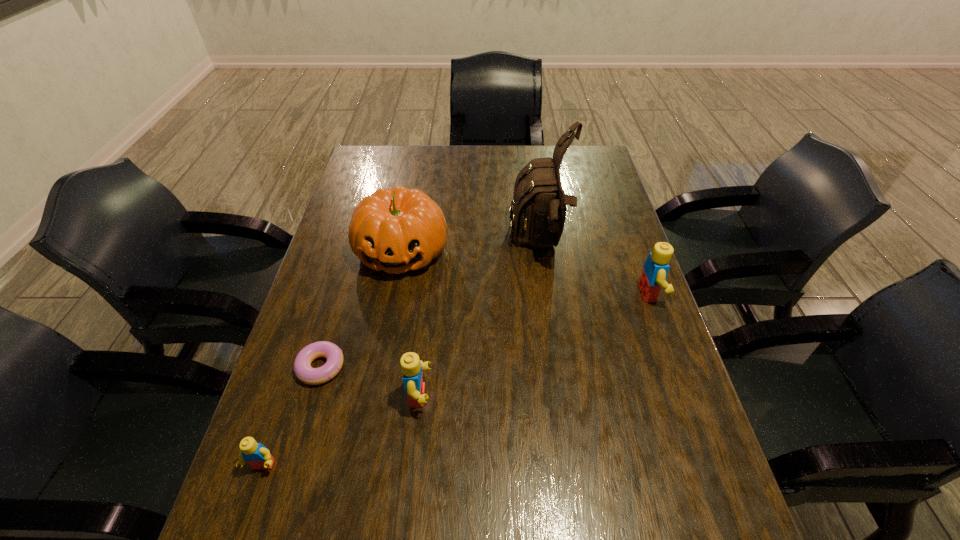
I want to click on object that is at the right edge, so click(655, 269).

This screenshot has height=540, width=960. Find the location of `object that is at the near left corner`. object that is at the near left corner is located at coordinates (257, 455).

What are the coordinates of `vacant space at the far edge` in the screenshot? It's located at (510, 157).

Identify the location of vacant space at the near edge of the desktop. (337, 484).

Find the location of a particular element. Image resolution: width=960 pixels, height=540 pixels. vacant area at the left edge is located at coordinates (342, 227).

Where is `vacant area at the right edge`? The width and height of the screenshot is (960, 540). vacant area at the right edge is located at coordinates (611, 205).

I want to click on free region at the far right corner of the desktop, so (576, 171).

Where is `vacant space that is in between the shortest object and the leftmost Lego`? The height and width of the screenshot is (540, 960). vacant space that is in between the shortest object and the leftmost Lego is located at coordinates (292, 416).

You are a GUI agent. You are given a task and a screenshot of the screen. Output one action in this format:
    pyautogui.click(x=<x>, y=<y>)
    Task: Click on the free spot between the pumpkin and the rightmost object
    This screenshot has width=960, height=540.
    Given the screenshot: What is the action you would take?
    pyautogui.click(x=526, y=272)

Where is `vacant space in between the third shortest object and the rightmost Lego`? This screenshot has height=540, width=960. vacant space in between the third shortest object and the rightmost Lego is located at coordinates (535, 345).